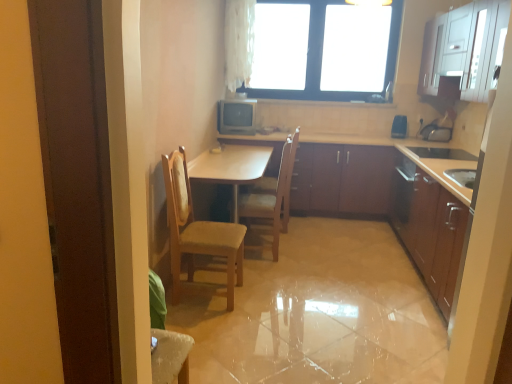
Question: Is wooden at center, marked as the 1th chair in a back-to-front arrangement, smaller than white glossy cabinet at upper right, arranged as the fourth cabinetry when ordered from the bottom?

Choices:
 (A) no
 (B) yes

Answer: (B)

Question: From a real-world perspective, is wooden at center, marked as the 1th chair in a back-to-front arrangement, positioned under white glossy cabinet at upper right, the 1th cabinetry from the top, based on gravity?

Choices:
 (A) no
 (B) yes

Answer: (B)

Question: Does wooden at center, marked as the 1th chair in a back-to-front arrangement, have a lesser width compared to white glossy cabinet at upper right, the 1th cabinetry from the top?

Choices:
 (A) yes
 (B) no

Answer: (B)

Question: From the image's perspective, is wooden at center, the 2th chair in the front-to-back sequence, located above white glossy cabinet at upper right, the 1th cabinetry from the top?

Choices:
 (A) no
 (B) yes

Answer: (A)

Question: Considering the relative positions of wooden at center, marked as the 1th chair in a back-to-front arrangement, and white glossy cabinet at upper right, the 1th cabinetry from the top, in the image provided, is wooden at center, marked as the 1th chair in a back-to-front arrangement, to the left of white glossy cabinet at upper right, the 1th cabinetry from the top, from the viewer's perspective?

Choices:
 (A) yes
 (B) no

Answer: (A)

Question: From the image's perspective, is wooden at center, the 2th chair in the front-to-back sequence, located beneath white glossy cabinet at upper right, the 1th cabinetry from the top?

Choices:
 (A) no
 (B) yes

Answer: (B)

Question: Is wooden chair at center, arranged as the second chair when viewed from the back, positioned far away from wooden cabinets at center, the 2th cabinetry in the bottom-to-top sequence?

Choices:
 (A) yes
 (B) no

Answer: (A)

Question: Is wooden chair at center, arranged as the second chair when viewed from the back, bigger than wooden cabinets at center, acting as the third cabinetry starting from the top?

Choices:
 (A) no
 (B) yes

Answer: (A)

Question: From a real-world perspective, is wooden chair at center, arranged as the second chair when viewed from the back, over wooden cabinets at center, acting as the third cabinetry starting from the top?

Choices:
 (A) yes
 (B) no

Answer: (A)

Question: From the image's perspective, is wooden chair at center, which is counted as the first chair, starting from the front, above wooden cabinets at center, the 2th cabinetry in the bottom-to-top sequence?

Choices:
 (A) no
 (B) yes

Answer: (A)

Question: Can wooden cabinets at center, acting as the third cabinetry starting from the top, be found inside wooden chair at center, arranged as the second chair when viewed from the back?

Choices:
 (A) yes
 (B) no

Answer: (B)

Question: Can you confirm if wooden chair at center, arranged as the second chair when viewed from the back, is positioned to the left of wooden cabinets at center, the 2th cabinetry in the bottom-to-top sequence?

Choices:
 (A) yes
 (B) no

Answer: (A)

Question: Is blue plastic speaker at upper right, arranged as the 2th appliance when viewed from the left, next to wooden chair at center, which is counted as the first chair, starting from the front, and touching it?

Choices:
 (A) yes
 (B) no

Answer: (B)